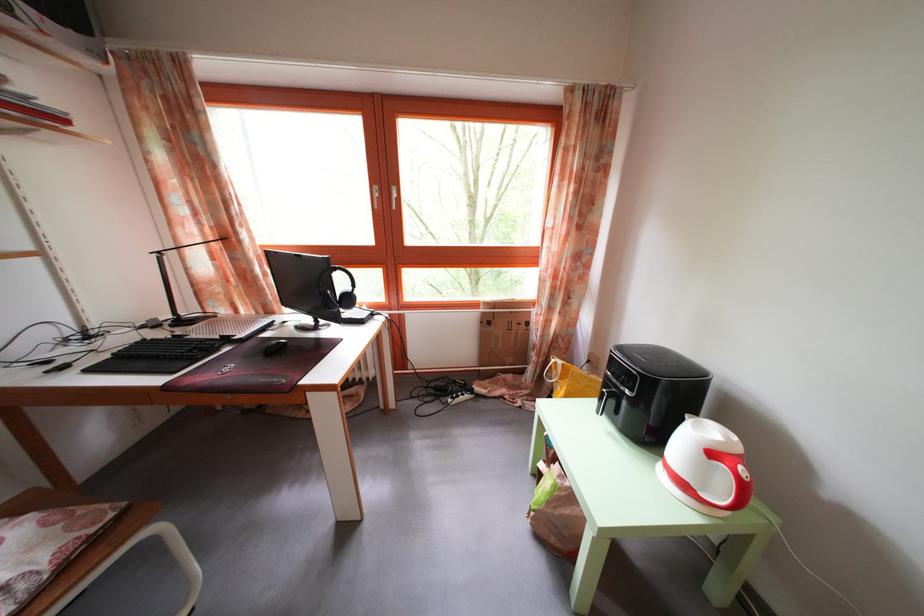
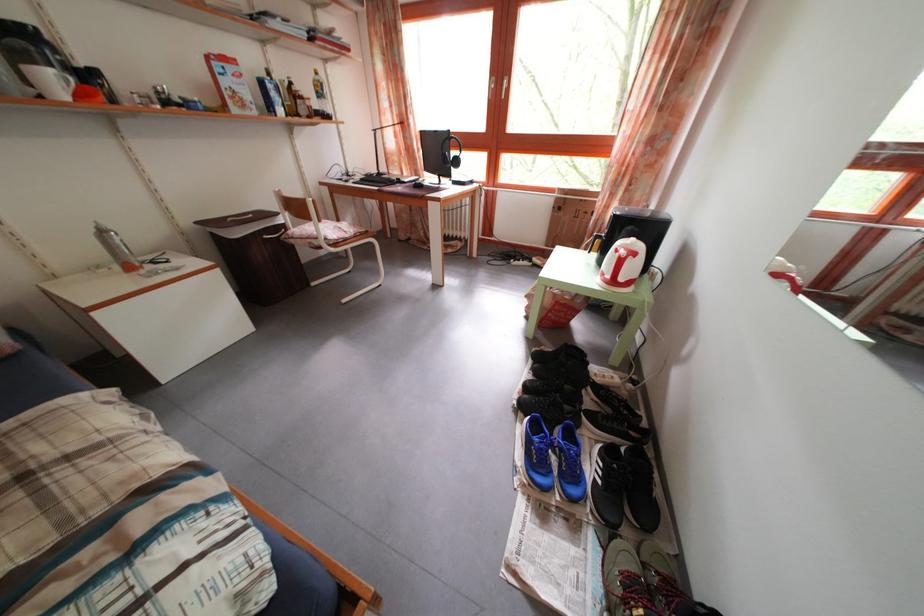
The point at (315,286) is marked in the first image. Where is the corresponding point in the second image?

(446, 160)